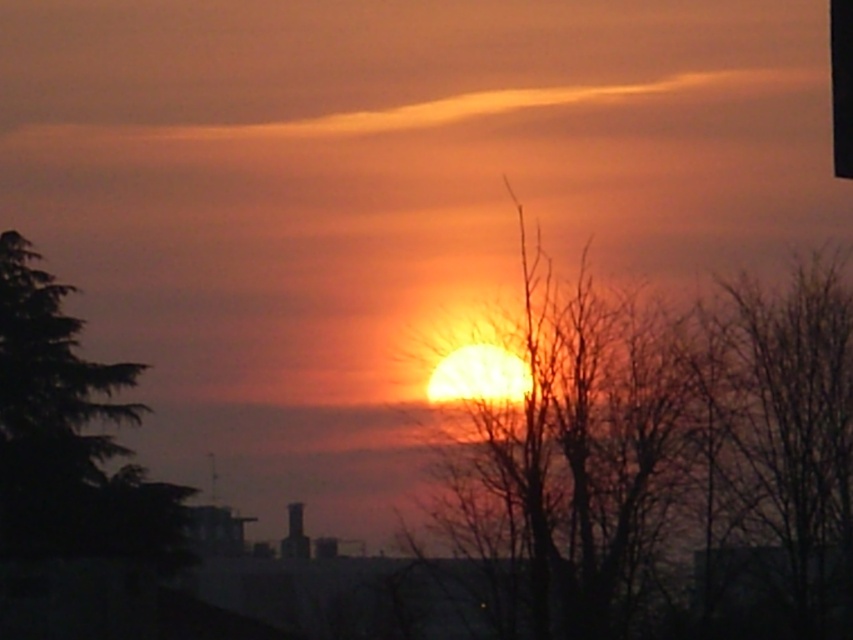
You are an artist sketching the sunset scene. You want to draw the bare branches at right and green leafy tree at left accurately. Which object should you sketch first to maintain depth perspective?

You should sketch the bare branches at right first because they are closer to the viewer than the green leafy tree at left, so they should be drawn in front to maintain proper depth perspective.

You are observing the sunset scene and notice the bare branches at right. Based on their position, can you determine if they are closer to the horizon or further away from it?

The bare branches at right are located at point (778,456), which places them closer to the horizon since their coordinates are near the lower part of the image frame.